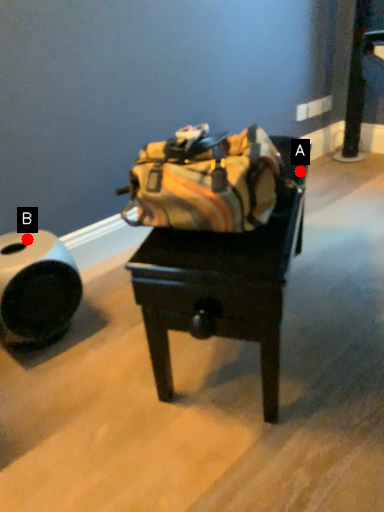
Question: Two points are circled on the image, labeled by A and B beside each circle. Which point is closer to the camera?

Choices:
 (A) A is closer
 (B) B is closer

Answer: (A)